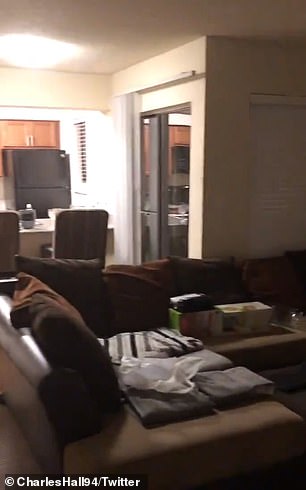
At what (x,y) coordinates should I click in order to perform the action: click on handle to open cabinet. Please return your answer as a coordinate pair (x, y). The image size is (306, 490). Looking at the image, I should click on (28, 141).